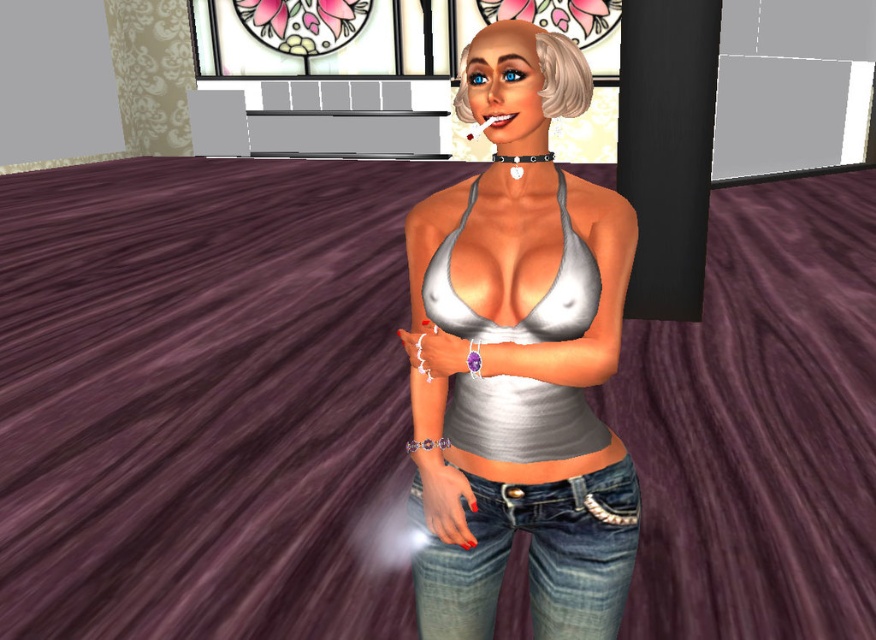
Between point (615, 449) and point (542, 323), which one is positioned behind?

Positioned behind is point (615, 449).

Looking at this image, can you confirm if silver metallic tank top at center is thinner than white matte bikini top at center?

In fact, silver metallic tank top at center might be wider than white matte bikini top at center.

Between point (504, 502) and point (564, 330), which one is positioned in front?

Point (564, 330)

Identify the location of silver metallic tank top at center. (519, 360).

Does denim jeans at center appear on the right side of white matte bikini top at center?

Indeed, denim jeans at center is positioned on the right side of white matte bikini top at center.

Which is more to the right, denim jeans at center or white matte bikini top at center?

Positioned to the right is denim jeans at center.

At what (x,y) coordinates should I click in order to perform the action: click on denim jeans at center. Please return your answer as a coordinate pair (x, y). Image resolution: width=876 pixels, height=640 pixels. Looking at the image, I should click on coord(535,557).

The height and width of the screenshot is (640, 876). I want to click on denim jeans at center, so click(x=535, y=557).

Is silver metallic tank top at center positioned before denim jeans at center?

Yes, silver metallic tank top at center is in front of denim jeans at center.

Does silver metallic tank top at center appear on the right side of denim jeans at center?

In fact, silver metallic tank top at center is to the left of denim jeans at center.

Where is `silver metallic tank top at center`? This screenshot has width=876, height=640. silver metallic tank top at center is located at coordinates (519, 360).